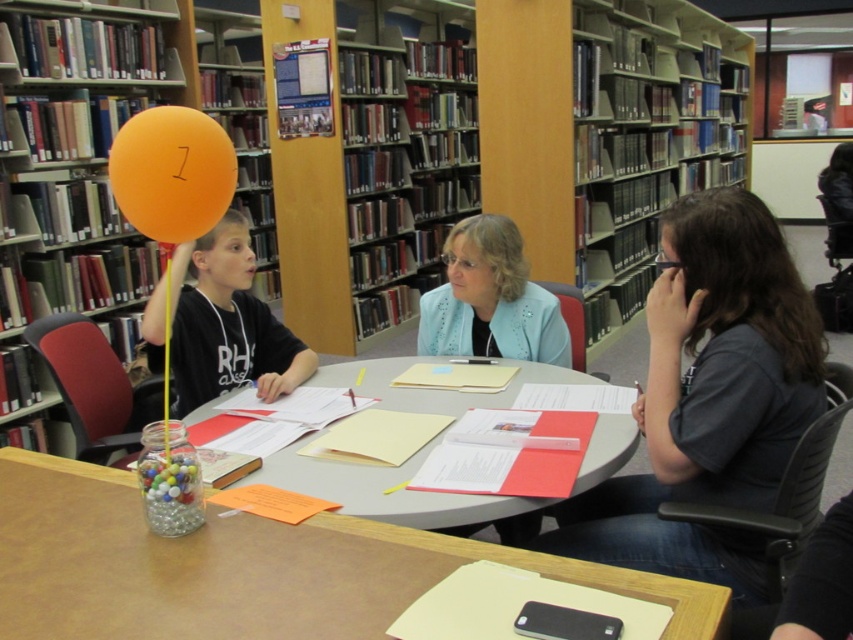
Question: Is blue fabric jacket at center to the left of clear plastic table at center from the viewer's perspective?

Choices:
 (A) yes
 (B) no

Answer: (B)

Question: Which object appears farthest from the camera in this image?

Choices:
 (A) blue fabric jacket at center
 (B) wooden table at center
 (C) orange matte balloon at upper left

Answer: (A)

Question: Is gray matte shirt at center bigger than wooden bookshelf at left?

Choices:
 (A) no
 (B) yes

Answer: (A)

Question: Which point is farther from the camera taking this photo?

Choices:
 (A) (437, 518)
 (B) (129, 49)
 (C) (462, 248)

Answer: (B)

Question: Which object is the farthest from the orange matte balloon at upper left?

Choices:
 (A) matte black shirt at center
 (B) gray matte shirt at center
 (C) wooden table at center
 (D) wooden bookshelf at left

Answer: (D)

Question: Does blue fabric jacket at center lie behind clear plastic table at center?

Choices:
 (A) no
 (B) yes

Answer: (B)